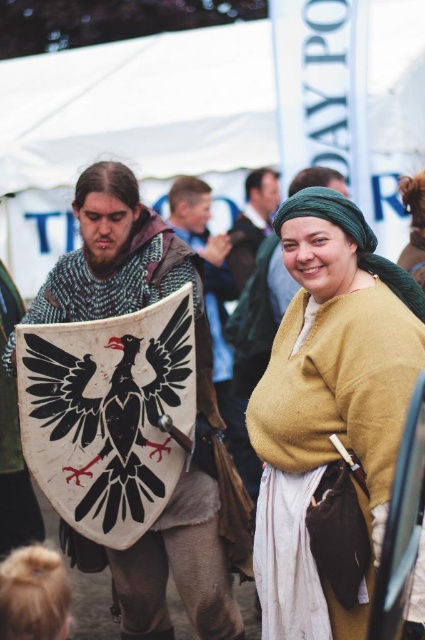
Does white leather shield at center have a greater height compared to black leather shield at center?

In fact, white leather shield at center may be shorter than black leather shield at center.

Between white leather shield at center and black leather shield at center, which one appears on the left side from the viewer's perspective?

Positioned to the left is white leather shield at center.

You are a GUI agent. You are given a task and a screenshot of the screen. Output one action in this format:
    pyautogui.click(x=<x>, y=<y>)
    Task: Click on the white leather shield at center
    
    Given the screenshot: What is the action you would take?
    pyautogui.click(x=197, y=406)

Between matte yellow sweater at center and knitted woolen sweater at center, which one has more height?

matte yellow sweater at center

Can you confirm if matte yellow sweater at center is positioned above knitted woolen sweater at center?

Actually, matte yellow sweater at center is below knitted woolen sweater at center.

At what (x,y) coordinates should I click in order to perform the action: click on matte yellow sweater at center. Please return your answer as a coordinate pair (x, y). This screenshot has height=640, width=425. Looking at the image, I should click on (329, 419).

Is white leather shield at center thinner than green woven headscarf at center?

In fact, white leather shield at center might be wider than green woven headscarf at center.

Does white leather shield at center appear under green woven headscarf at center?

Yes.

What do you see at coordinates (197, 406) in the screenshot? I see `white leather shield at center` at bounding box center [197, 406].

Identify the location of white leather shield at center. (197, 406).